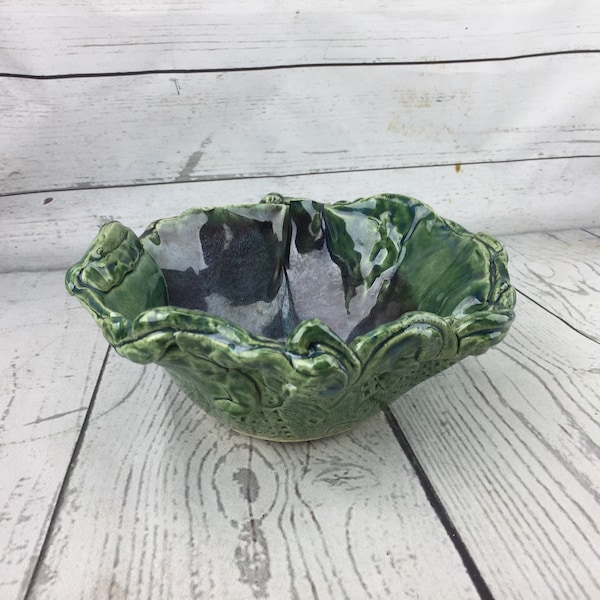
The height and width of the screenshot is (600, 600). What are the coordinates of `bowl` in the screenshot? It's located at (311, 394).